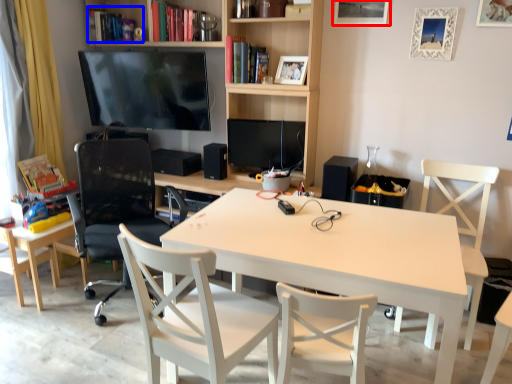
Question: Which object is closer to the camera taking this photo, picture frame (highlighted by a red box) or book (highlighted by a blue box)?

Choices:
 (A) picture frame
 (B) book

Answer: (A)